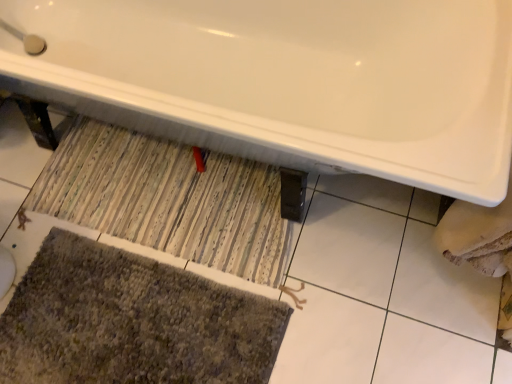
Locate an element on the screen. The width and height of the screenshot is (512, 384). vacant space that's between textured gray bath mat at lower left and striped fabric doormat at center is located at coordinates (95, 250).